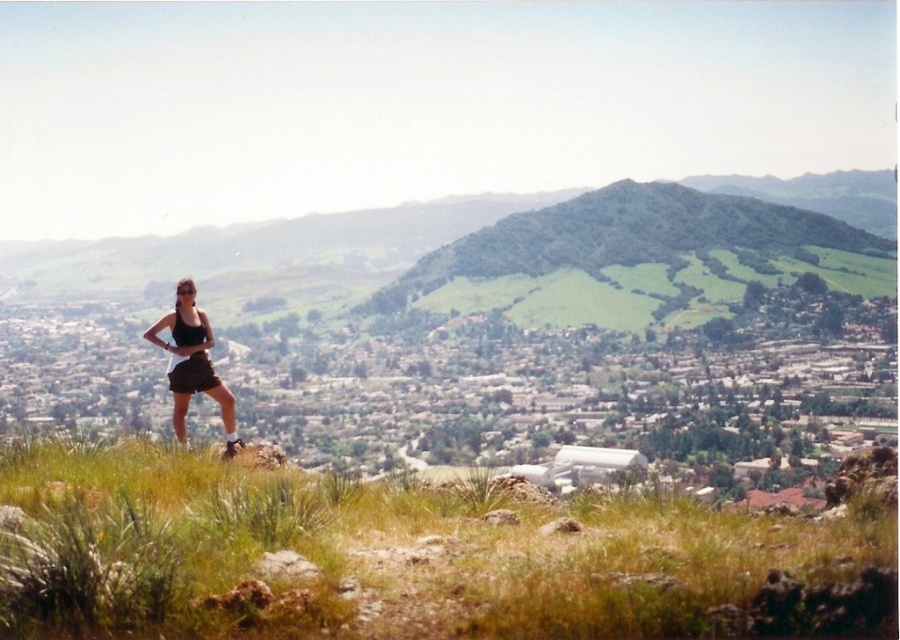
Question: Based on their relative distances, which object is nearer to the black matte shorts at center?

Choices:
 (A) green grassy at left
 (B) matte black tank top at center

Answer: (B)

Question: Is matte black tank top at center positioned before black matte shorts at center?

Choices:
 (A) no
 (B) yes

Answer: (B)

Question: Which is farther from the black matte shorts at center?

Choices:
 (A) matte black tank top at center
 (B) green grassy at left

Answer: (B)

Question: Does matte black tank top at center appear under black matte shorts at center?

Choices:
 (A) no
 (B) yes

Answer: (B)

Question: Does green grassy at left appear on the left side of black matte shorts at center?

Choices:
 (A) yes
 (B) no

Answer: (B)

Question: Which object is closer to the camera taking this photo?

Choices:
 (A) matte black tank top at center
 (B) black matte shorts at center
 (C) green grassy at left

Answer: (C)